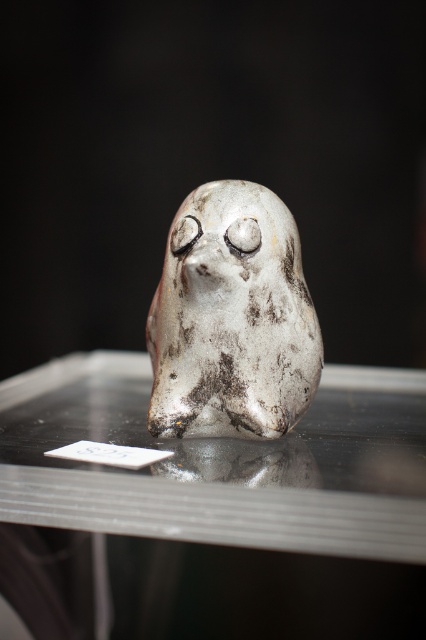
Question: Which point is farther from the camera taking this photo?

Choices:
 (A) (258, 275)
 (B) (333, 544)

Answer: (A)

Question: Can you confirm if transparent glass table at center is positioned below shiny metallic bird at center?

Choices:
 (A) no
 (B) yes

Answer: (B)

Question: Which object is farther from the camera taking this photo?

Choices:
 (A) shiny metallic bird at center
 (B) transparent glass table at center

Answer: (A)

Question: Observing the image, what is the correct spatial positioning of transparent glass table at center in reference to shiny metallic bird at center?

Choices:
 (A) above
 (B) below

Answer: (B)

Question: Observing the image, what is the correct spatial positioning of transparent glass table at center in reference to shiny metallic bird at center?

Choices:
 (A) below
 (B) above

Answer: (A)

Question: Which point is closer to the camera?

Choices:
 (A) (51, 406)
 (B) (249, 240)

Answer: (B)